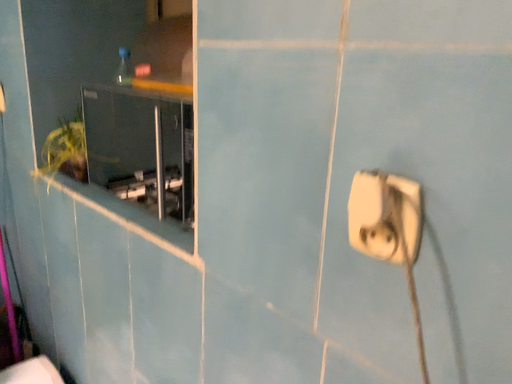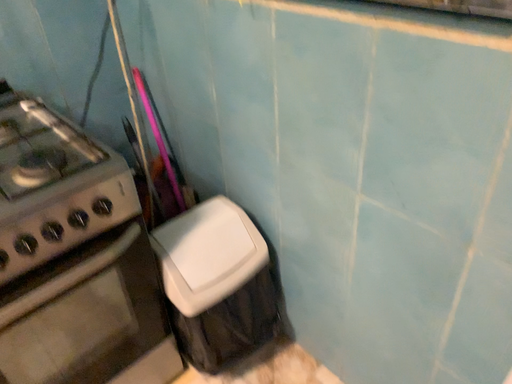
Question: How did the camera likely rotate when shooting the video?

Choices:
 (A) rotated upward
 (B) rotated downward

Answer: (B)